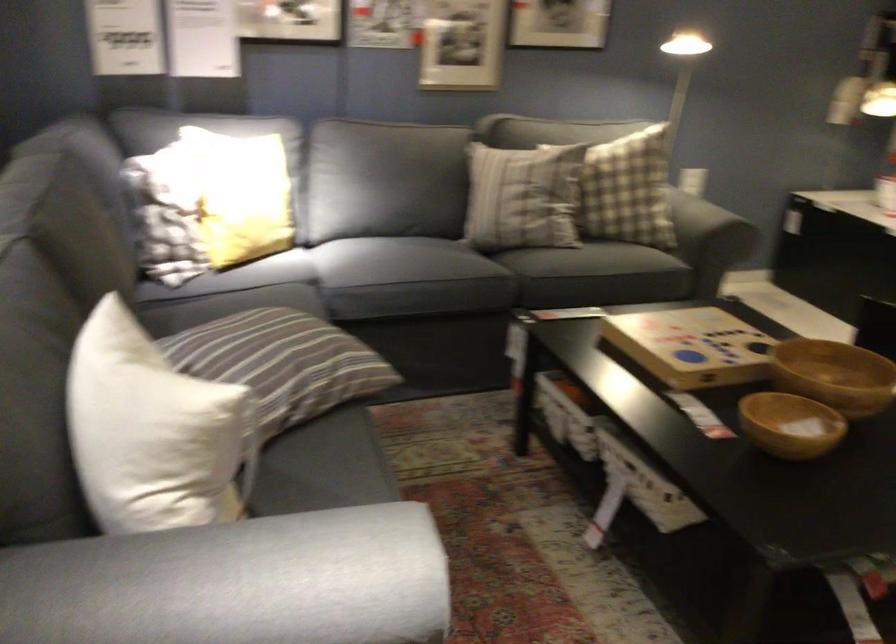
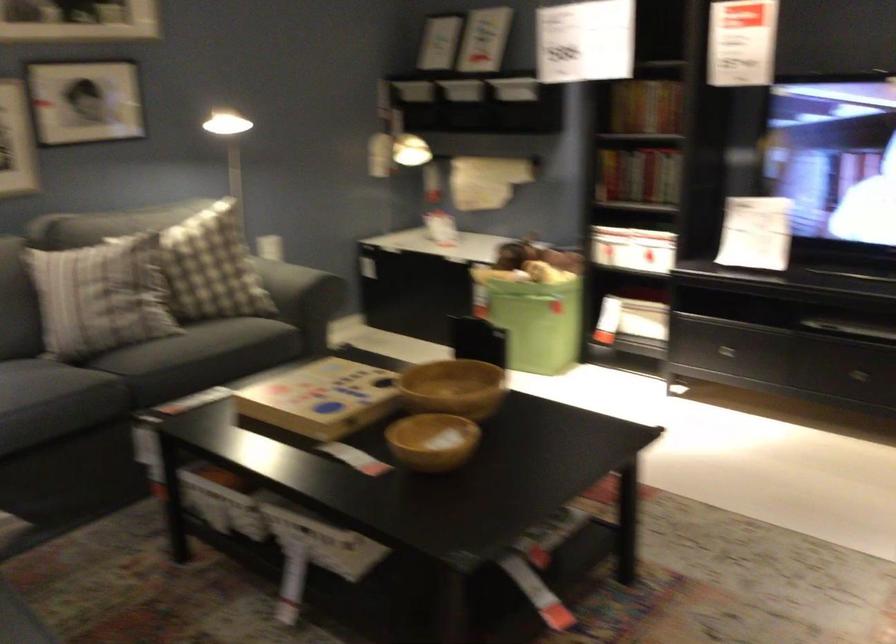
Find the pixel in the second image that matches (633,187) in the first image.

(211, 267)